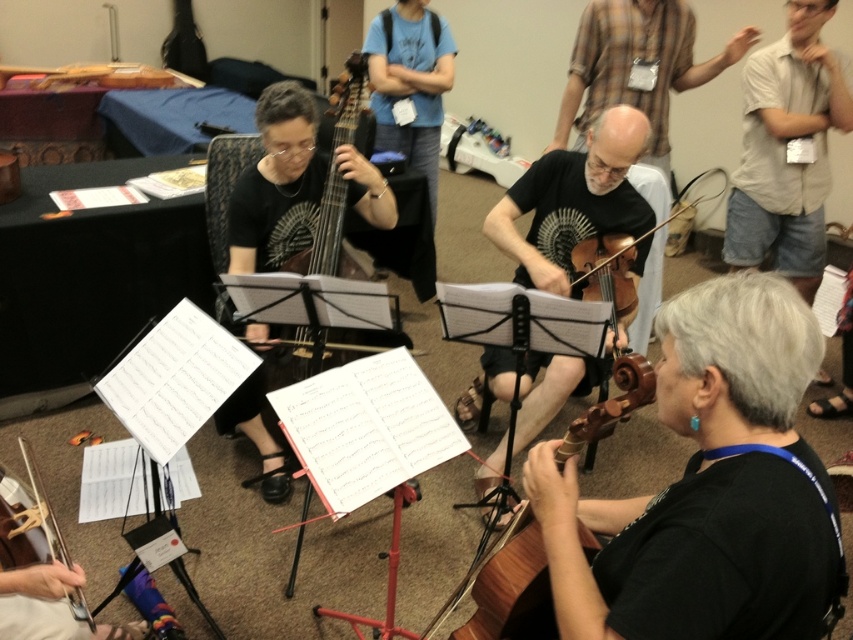
Question: Which object appears closest to the camera in this image?

Choices:
 (A) brown wooden violin at center
 (B) wooden violin at lower right

Answer: (B)

Question: In this image, where is wooden violin at lower right located relative to brown wooden violin at center?

Choices:
 (A) right
 (B) left

Answer: (B)

Question: Does wooden violin at lower right come behind wooden polished cello at center-left?

Choices:
 (A) yes
 (B) no

Answer: (B)

Question: Is brown wooden violin at center above brown wooden violin at lower center?

Choices:
 (A) no
 (B) yes

Answer: (B)

Question: Which of the following is the closest to the observer?

Choices:
 (A) (740, 616)
 (B) (289, 198)

Answer: (A)

Question: Based on their relative distances, which object is nearer to the brown wooden violin at lower center?

Choices:
 (A) wooden polished cello at center-left
 (B) brown wooden violin at center
 (C) wooden violin at lower right

Answer: (C)